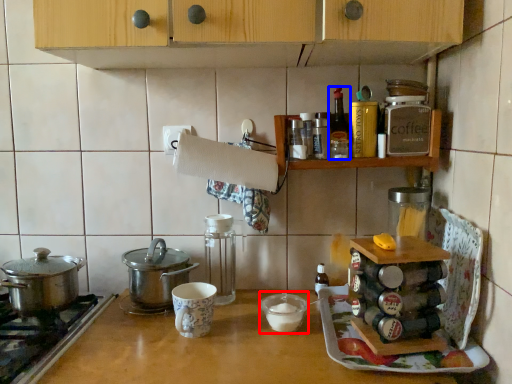
Question: Which of the following is the farthest to the observer, appliance (highlighted by a red box) or kitchen appliance (highlighted by a blue box)?

Choices:
 (A) appliance
 (B) kitchen appliance

Answer: (B)